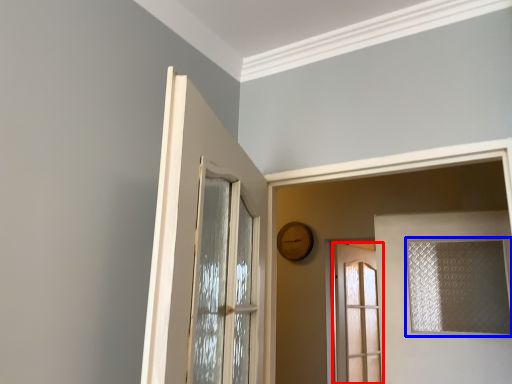
Question: Which object is further to the camera taking this photo, door (highlighted by a red box) or window (highlighted by a blue box)?

Choices:
 (A) door
 (B) window

Answer: (A)